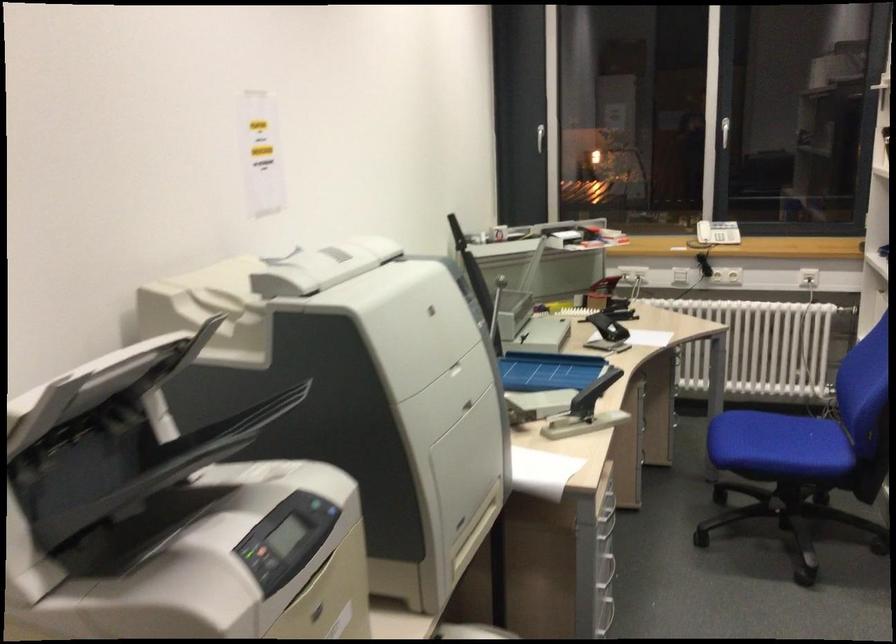
Find the location of a particular element. The image size is (896, 644). open scanner lid is located at coordinates (106, 384).